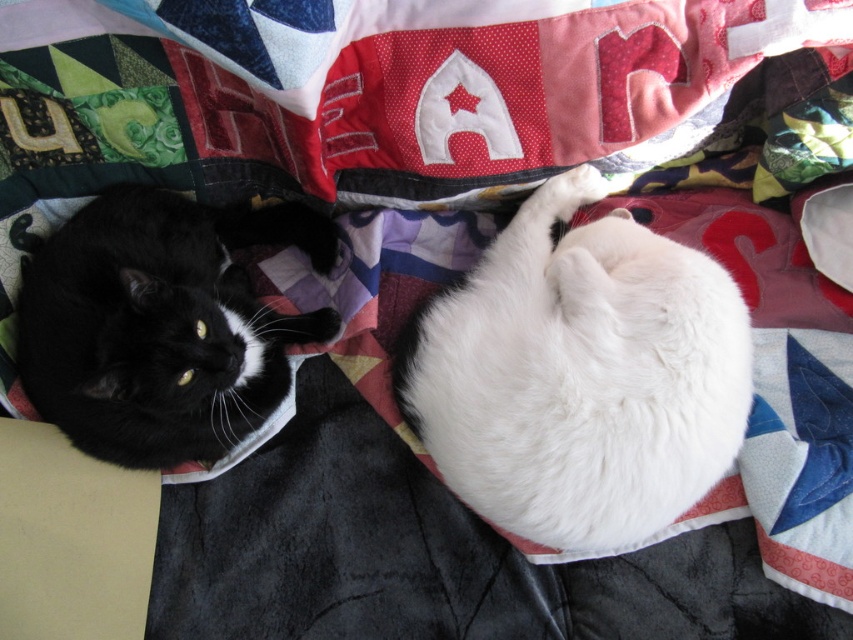
Does white fluffy cat at center appear on the right side of black fur cat at left?

Indeed, white fluffy cat at center is positioned on the right side of black fur cat at left.

This screenshot has width=853, height=640. What do you see at coordinates (581, 376) in the screenshot?
I see `white fluffy cat at center` at bounding box center [581, 376].

Who is more forward, (x=583, y=397) or (x=170, y=456)?

Point (x=583, y=397) is more forward.

Find the location of a particular element. white fluffy cat at center is located at coordinates (581, 376).